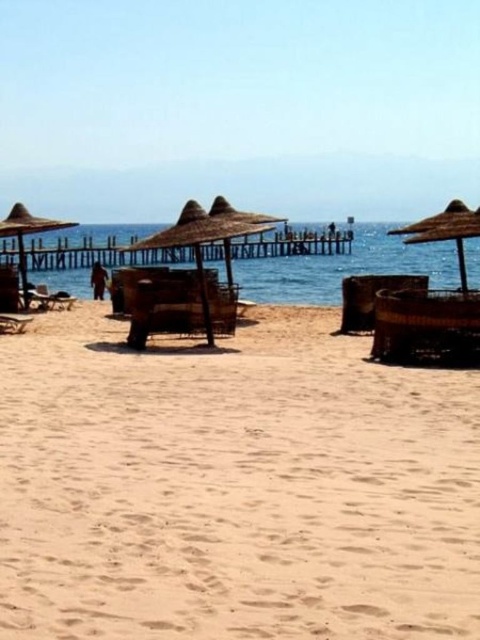
You are standing on the beach and want to walk to the wooden pier. You see the blue water at center and the brown woven umbrella at center. Which object is closer to you, and which is farther away?

The brown woven umbrella at center is farther away because it is behind the blue water at center, which is closer to you.

You are standing at the edge of the wooden pier in the background of the beach scene. You notice a point marked at coordinates (338, 266). What is located at that point?

The point at coordinates (338, 266) corresponds to blue water at center.